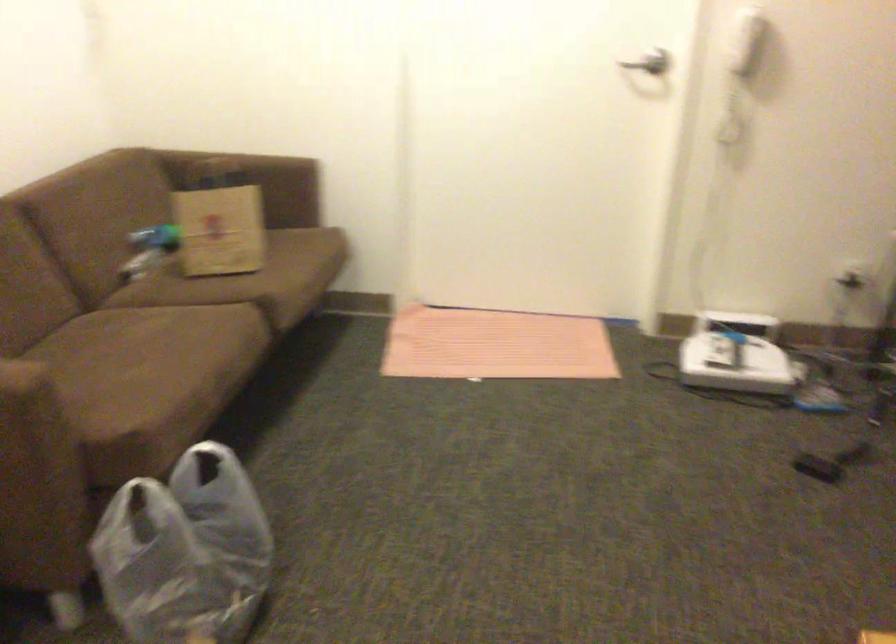
Find the location of a particular element. Image resolution: width=896 pixels, height=644 pixels. white telephone handset is located at coordinates (739, 69).